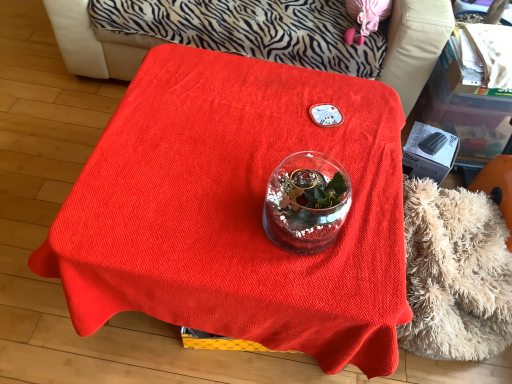
Question: Is fluffy beige blanket at lower right smaller than smooth red tablecloth at center?

Choices:
 (A) no
 (B) yes

Answer: (B)

Question: Is fluffy beige blanket at lower right to the left of smooth red tablecloth at center from the viewer's perspective?

Choices:
 (A) no
 (B) yes

Answer: (A)

Question: Is fluffy beige blanket at lower right further to camera compared to smooth red tablecloth at center?

Choices:
 (A) no
 (B) yes

Answer: (A)

Question: Is fluffy beige blanket at lower right far from smooth red tablecloth at center?

Choices:
 (A) no
 (B) yes

Answer: (B)

Question: From the image's perspective, is fluffy beige blanket at lower right beneath smooth red tablecloth at center?

Choices:
 (A) yes
 (B) no

Answer: (A)

Question: Is point (295, 175) positioned closer to the camera than point (403, 220)?

Choices:
 (A) farther
 (B) closer

Answer: (B)

Question: Considering the positions of transparent glass vase at center and fluffy beige blanket at lower right in the image, is transparent glass vase at center wider or thinner than fluffy beige blanket at lower right?

Choices:
 (A) wide
 (B) thin

Answer: (B)

Question: From the image's perspective, relative to fluffy beige blanket at lower right, is transparent glass vase at center above or below?

Choices:
 (A) above
 (B) below

Answer: (A)

Question: In the image, is transparent glass vase at center on the left side or the right side of fluffy beige blanket at lower right?

Choices:
 (A) right
 (B) left

Answer: (B)

Question: Is point (393, 23) closer or farther from the camera than point (291, 210)?

Choices:
 (A) farther
 (B) closer

Answer: (A)

Question: Considering the relative positions of smooth red tablecloth at center and transparent glass vase at center in the image provided, is smooth red tablecloth at center to the left or to the right of transparent glass vase at center?

Choices:
 (A) left
 (B) right

Answer: (A)

Question: Based on their sizes in the image, would you say smooth red tablecloth at center is bigger or smaller than transparent glass vase at center?

Choices:
 (A) small
 (B) big

Answer: (B)

Question: Is smooth red tablecloth at center taller or shorter than transparent glass vase at center?

Choices:
 (A) tall
 (B) short

Answer: (A)

Question: Would you say smooth red tablecloth at center is to the left or to the right of black plastic box at right in the picture?

Choices:
 (A) right
 (B) left

Answer: (B)

Question: Is point (442, 29) positioned closer to the camera than point (412, 155)?

Choices:
 (A) farther
 (B) closer

Answer: (A)